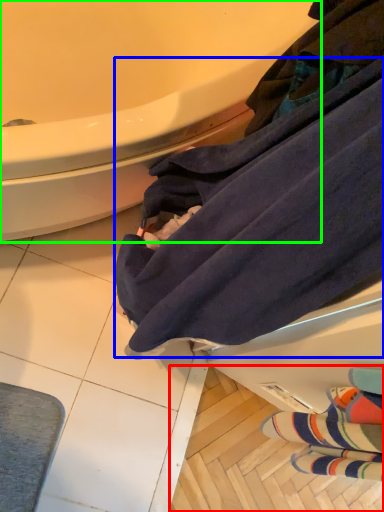
Question: Considering the real-world distances, which object is closest to tile (highlighted by a red box)? bath towel (highlighted by a blue box) or bathtub (highlighted by a green box).

Choices:
 (A) bath towel
 (B) bathtub

Answer: (A)